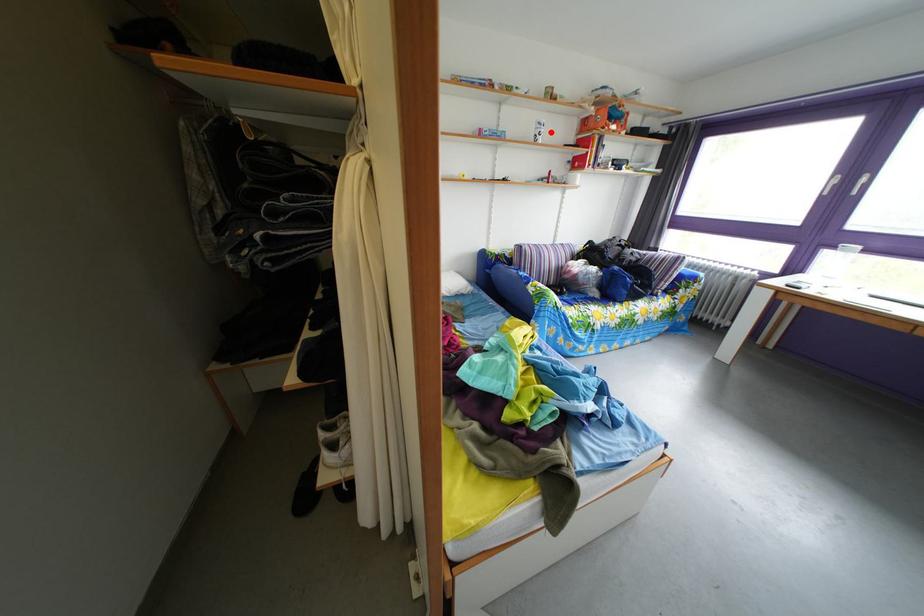
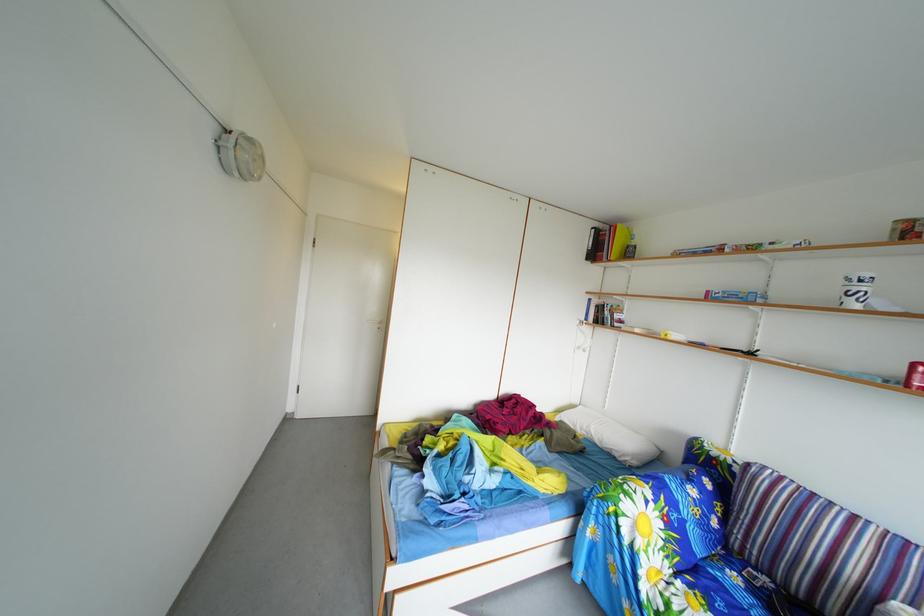
Question: I am providing you with two images of the same scene from different viewpoints. Image1 has a red point marked. In image2, the corresponding 3D location appears at what relative position? Reply with the corresponding letter.

Choices:
 (A) Closer
 (B) Farther

Answer: (B)